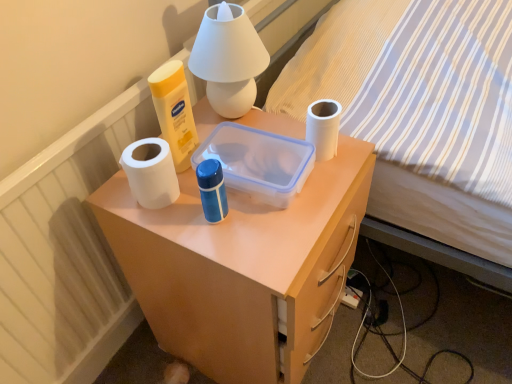
The image size is (512, 384). What do you see at coordinates (228, 59) in the screenshot? I see `white matte table lamp at upper center` at bounding box center [228, 59].

What is the approximate width of white matte paper towel at left?

3.61 inches.

In order to face white matte paper towel at left, should I rotate leftwards or rightwards?

Rotate your view left by about 13.581°.

Locate an element on the screen. The image size is (512, 384). striped fabric bed at upper right is located at coordinates (405, 125).

Is point (175, 339) closer or farther from the camera than point (316, 117)?

Clearly, point (175, 339) is more distant from the camera than point (316, 117).

From the image's perspective, which one is positioned higher, white matte desk at center or white matte toilet paper at right?

white matte toilet paper at right is shown above in the image.

In the scene shown: Is white matte desk at center touching white matte toilet paper at right?

white matte desk at center and white matte toilet paper at right are clearly separated.

Which object is closer to the camera, white matte table lamp at upper center or white matte toilet paper at right?

white matte table lamp at upper center is closer to the camera.

Which of these two, white matte table lamp at upper center or white matte toilet paper at right, is smaller?

Smaller between the two is white matte toilet paper at right.

Is white matte table lamp at upper center positioned beyond the bounds of white matte toilet paper at right?

Yes.

Does point (254, 82) appear closer or farther from the camera than point (313, 102)?

Point (254, 82) appears to be closer to the viewer than point (313, 102).

How much distance is there between white matte toilet paper at right and striped fabric bed at upper right?

They are 16.99 inches apart.

Is white matte toilet paper at right oriented towards striped fabric bed at upper right?

No, white matte toilet paper at right does not turn towards striped fabric bed at upper right.

What's the angular difference between white matte toilet paper at right and striped fabric bed at upper right's facing directions?

0.415 degrees separate the facing orientations of white matte toilet paper at right and striped fabric bed at upper right.

From a real-world perspective, does white matte toilet paper at right sit lower than striped fabric bed at upper right?

No, from a real-world perspective, white matte toilet paper at right is not below striped fabric bed at upper right.

Are white matte desk at center and striped fabric bed at upper right making contact?

No, white matte desk at center is not in contact with striped fabric bed at upper right.

At what (x,y) coordinates should I click in order to perform the action: click on bed on the right of white matte desk at center. Please return your answer as a coordinate pair (x, y). Looking at the image, I should click on (405, 125).

Which object is positioned more to the left, white matte desk at center or striped fabric bed at upper right?

Positioned to the left is white matte desk at center.

Can you confirm if white matte toilet paper at right is positioned to the left of white matte table lamp at upper center?

No, white matte toilet paper at right is not to the left of white matte table lamp at upper center.

How different are the orientations of white matte toilet paper at right and white matte table lamp at upper center in degrees?

There is a 0.0041-degree angle between the facing directions of white matte toilet paper at right and white matte table lamp at upper center.

Which is behind, point (311, 118) or point (222, 81)?

The point (222, 81) is farther.

In order to click on paper towel below the white matte table lamp at upper center (from the image's perspective) in this screenshot , I will do `click(151, 172)`.

From the image's perspective, which is below, white matte table lamp at upper center or white matte paper towel at left?

white matte paper towel at left.

Between white matte table lamp at upper center and white matte paper towel at left, which one is positioned in front?

Positioned in front is white matte paper towel at left.

From their relative heights in the image, would you say white matte table lamp at upper center is taller or shorter than white matte paper towel at left?

In the image, white matte table lamp at upper center appears to be taller than white matte paper towel at left.

Considering the relative sizes of white matte paper towel at left and white matte table lamp at upper center in the image provided, is white matte paper towel at left bigger than white matte table lamp at upper center?

Actually, white matte paper towel at left might be smaller than white matte table lamp at upper center.

Would you say white matte paper towel at left is outside white matte table lamp at upper center?

Yes.

From the picture: Is white matte paper towel at left looking in the opposite direction of white matte table lamp at upper center?

white matte paper towel at left is not turned away from white matte table lamp at upper center.

Where is `paper towel on the left of white matte table lamp at upper center`? This screenshot has height=384, width=512. paper towel on the left of white matte table lamp at upper center is located at coordinates (151, 172).

Where is `toilet paper that appears above the white matte desk at center (from the image's perspective)`? The height and width of the screenshot is (384, 512). toilet paper that appears above the white matte desk at center (from the image's perspective) is located at coordinates (323, 127).

Image resolution: width=512 pixels, height=384 pixels. Find the location of `table lamp in front of the white matte toilet paper at right`. table lamp in front of the white matte toilet paper at right is located at coordinates (228, 59).

Which object lies further to the anchor point white matte toilet paper at right, white matte desk at center or white matte paper towel at left?

Based on the image, white matte desk at center appears to be further to white matte toilet paper at right.

Looking at the image, which one is located closer to white matte table lamp at upper center, striped fabric bed at upper right or white matte paper towel at left?

white matte paper towel at left is closer to white matte table lamp at upper center.

Based on their spatial positions, is white matte paper towel at left or white matte desk at center further from white matte table lamp at upper center?

The object further to white matte table lamp at upper center is white matte desk at center.

When comparing their distances from white matte table lamp at upper center, does striped fabric bed at upper right or white matte toilet paper at right seem further?

The object further to white matte table lamp at upper center is striped fabric bed at upper right.

Based on their spatial positions, is white matte table lamp at upper center or striped fabric bed at upper right further from white matte toilet paper at right?

Among the two, striped fabric bed at upper right is located further to white matte toilet paper at right.

From the image, which object appears to be nearer to white matte paper towel at left, white matte toilet paper at right or white matte table lamp at upper center?

white matte table lamp at upper center is closer to white matte paper towel at left.

From the image, which object appears to be nearer to white matte toilet paper at right, white matte table lamp at upper center or white matte desk at center?

white matte table lamp at upper center.

Which object lies further to the anchor point striped fabric bed at upper right, white matte desk at center or white matte toilet paper at right?

Among the two, white matte toilet paper at right is located further to striped fabric bed at upper right.

What are the coordinates of `toilet paper between white matte table lamp at upper center and white matte desk at center vertically` in the screenshot? It's located at (323, 127).

Where is `table lamp between white matte paper towel at left and striped fabric bed at upper right`? This screenshot has width=512, height=384. table lamp between white matte paper towel at left and striped fabric bed at upper right is located at coordinates (228, 59).

You are a GUI agent. You are given a task and a screenshot of the screen. Output one action in this format:
    pyautogui.click(x=<x>, y=<y>)
    Task: Click on the toilet paper situated between white matte desk at center and striped fabric bed at upper right from left to right
    This screenshot has width=512, height=384.
    Given the screenshot: What is the action you would take?
    pyautogui.click(x=323, y=127)

Image resolution: width=512 pixels, height=384 pixels. Find the location of `desk between white matte paper towel at left and striped fabric bed at upper right in the horizontal direction`. desk between white matte paper towel at left and striped fabric bed at upper right in the horizontal direction is located at coordinates (241, 268).